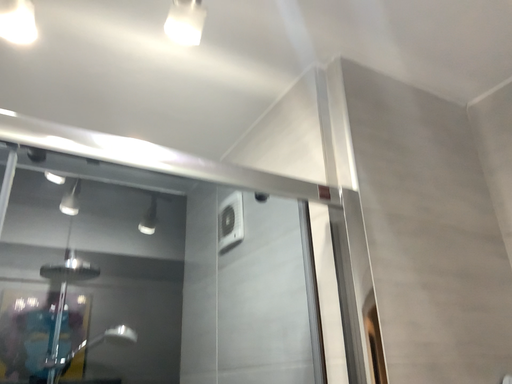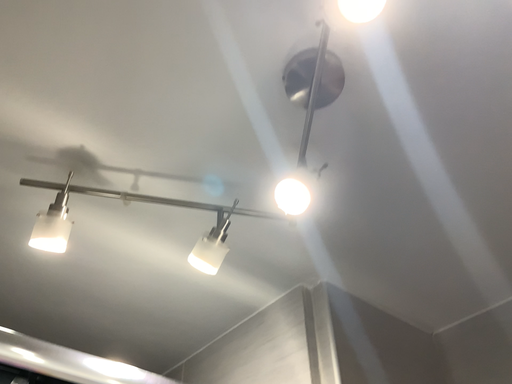
Question: How did the camera likely rotate when shooting the video?

Choices:
 (A) rotated right
 (B) rotated left

Answer: (A)